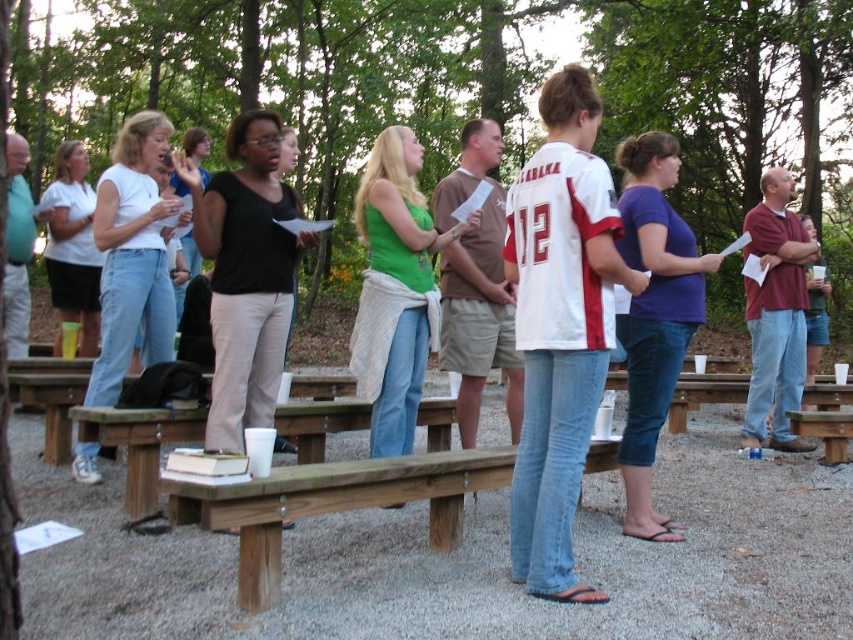
Question: Is brown wooden bench at center positioned before brown wooden bench at lower right?

Choices:
 (A) no
 (B) yes

Answer: (B)

Question: Which object appears closest to the camera in this image?

Choices:
 (A) brown wooden bench at lower right
 (B) brown wooden bench at center

Answer: (B)

Question: Does brown wooden bench at center appear on the left side of brown wooden bench at lower right?

Choices:
 (A) no
 (B) yes

Answer: (B)

Question: Is brown wooden bench at center in front of brown wooden bench at lower right?

Choices:
 (A) no
 (B) yes

Answer: (B)

Question: Which of the following is the closest to the observer?

Choices:
 (A) (813, 412)
 (B) (339, 476)

Answer: (B)

Question: Which of the following is the closest to the observer?

Choices:
 (A) brown wooden bench at lower right
 (B) brown wooden bench at center

Answer: (B)